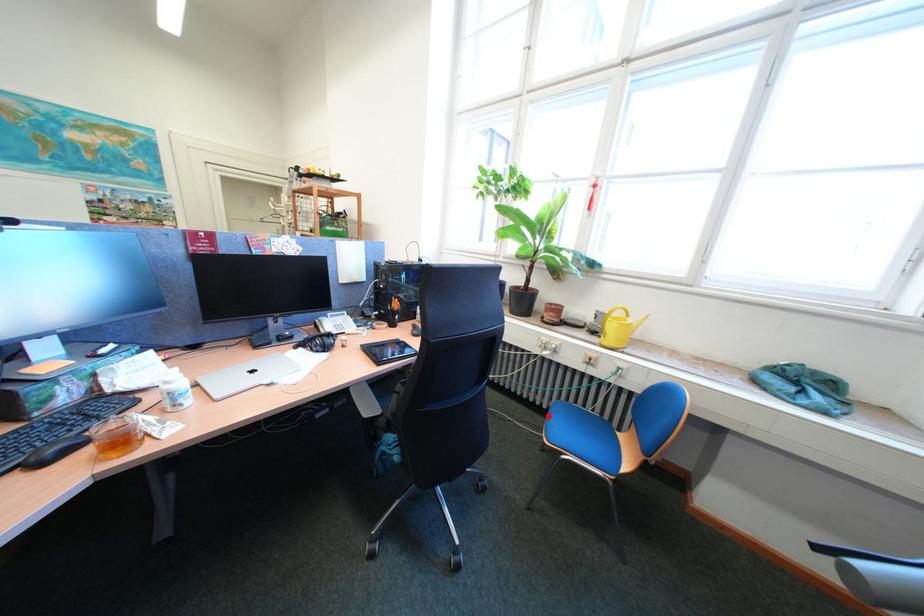
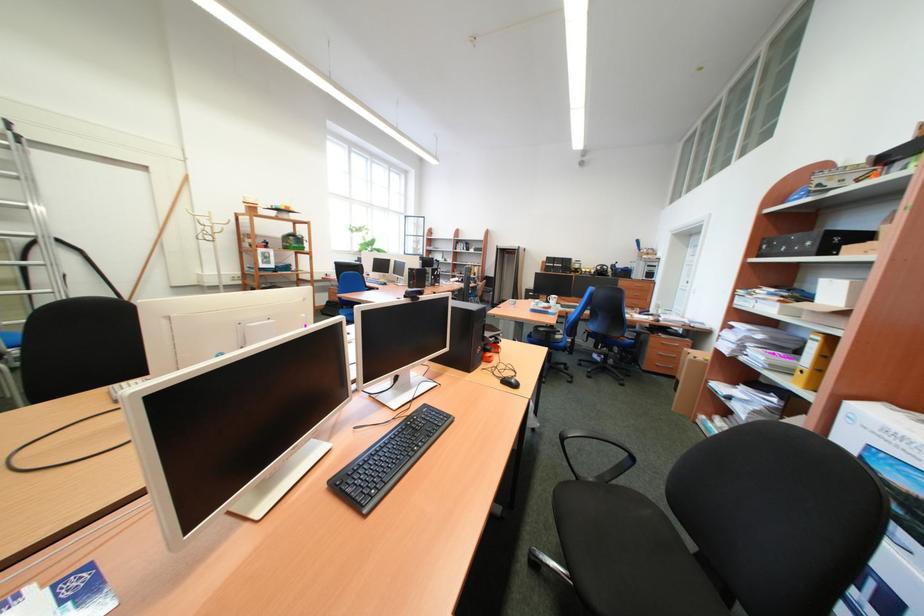
Question: I am providing you with two images of the same scene from different viewpoints. A red point is marked on the first image. Can you still see the location of the red point in image 2?

Choices:
 (A) Yes
 (B) No

Answer: (B)